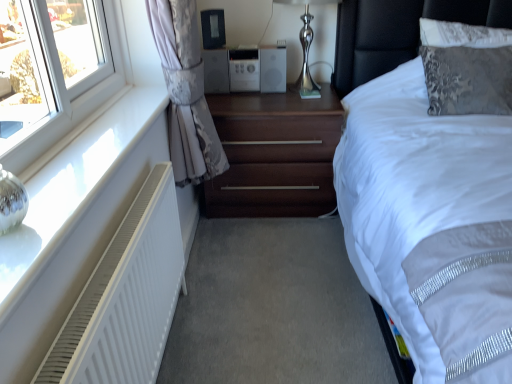
What do you see at coordinates (245, 70) in the screenshot?
I see `silver metallic stereo at center` at bounding box center [245, 70].

At what (x,y) coordinates should I click in order to perform the action: click on silver metallic stereo at center. Please return your answer as a coordinate pair (x, y). Looking at the image, I should click on (245, 70).

Describe the element at coordinates (275, 154) in the screenshot. I see `dark wood nightstand at center` at that location.

Find the location of `silky gray curtain at left`. silky gray curtain at left is located at coordinates (186, 92).

Where is `black plastic speaker at upper center`? The height and width of the screenshot is (384, 512). black plastic speaker at upper center is located at coordinates (213, 28).

Where is `white satin bed at right`? The width and height of the screenshot is (512, 384). white satin bed at right is located at coordinates (398, 32).

Would you consider white satin bed at right to be distant from silver metallic stereo at center?

No.

Could you tell me if white satin bed at right is turned towards silver metallic stereo at center?

No, white satin bed at right is not turned towards silver metallic stereo at center.

Is white satin bed at right outside of silver metallic stereo at center?

white satin bed at right lies outside silver metallic stereo at center's area.

Based on their positions, is white satin bed at right located to the left or right of silver metallic stereo at center?

Clearly, white satin bed at right is on the right of silver metallic stereo at center in the image.

Based on their positions, is dark wood nightstand at center located to the left or right of white matte radiator at left?

Clearly, dark wood nightstand at center is on the right of white matte radiator at left in the image.

Can you confirm if dark wood nightstand at center is wider than white matte radiator at left?

Indeed, dark wood nightstand at center has a greater width compared to white matte radiator at left.

Is dark wood nightstand at center facing away from white matte radiator at left?

No, dark wood nightstand at center's orientation is not away from white matte radiator at left.

From the image's perspective, which is above, dark wood nightstand at center or white matte radiator at left?

dark wood nightstand at center.

From a real-world perspective, which object stands above the other?

From a 3D spatial view, black leather headboard at upper right is above.

Is white satin bed at right a part of black leather headboard at upper right?

No.

From the image's perspective, is black leather headboard at upper right located beneath white satin bed at right?

No.

Is black leather headboard at upper right closer to the viewer compared to white satin bed at right?

No, the depth of black leather headboard at upper right is greater than that of white satin bed at right.

Is silky gray curtain at left wider than white matte radiator at lower left?

Incorrect, the width of silky gray curtain at left does not surpass that of white matte radiator at lower left.

Is silky gray curtain at left with white matte radiator at lower left?

No, silky gray curtain at left is not beside white matte radiator at lower left.

Is silky gray curtain at left outside of white matte radiator at lower left?

That's correct, silky gray curtain at left is outside of white matte radiator at lower left.

Does white matte radiator at left have a larger size compared to silver metallic stereo at center?

Yes.

Consider the image. From the image's perspective, who appears lower, white matte radiator at left or silver metallic stereo at center?

white matte radiator at left.

Is white matte radiator at left taller or shorter than silver metallic stereo at center?

In the image, white matte radiator at left appears to be taller than silver metallic stereo at center.

Is silky gray curtain at left oriented towards white satin bed at right?

Yes, silky gray curtain at left is aimed at white satin bed at right.

Considering the sizes of objects silky gray curtain at left and white satin bed at right in the image provided, who is smaller, silky gray curtain at left or white satin bed at right?

Smaller between the two is silky gray curtain at left.

This screenshot has width=512, height=384. Identify the location of bed below the silky gray curtain at left (from a real-world perspective). (398, 32).

Is black leather headboard at upper right facing towards white matte radiator at lower left?

No, black leather headboard at upper right is not aimed at white matte radiator at lower left.

What's the angular difference between black leather headboard at upper right and white matte radiator at lower left's facing directions?

The facing directions of black leather headboard at upper right and white matte radiator at lower left are 90.9 degrees apart.

Would you consider black leather headboard at upper right to be distant from white matte radiator at lower left?

black leather headboard at upper right is positioned a significant distance from white matte radiator at lower left.

From the picture: Visually, is black leather headboard at upper right positioned to the left or to the right of white matte radiator at lower left?

In the image, black leather headboard at upper right appears on the right side of white matte radiator at lower left.

Image resolution: width=512 pixels, height=384 pixels. What are the coordinates of `stereo behind the white satin bed at right` in the screenshot? It's located at (245, 70).

In the image, there is a white matte radiator at left. At what (x,y) coordinates should I click in order to perform the action: click on nightstand above it (from the image's perspective). Please return your answer as a coordinate pair (x, y). Image resolution: width=512 pixels, height=384 pixels. Looking at the image, I should click on (275, 154).

Based on their spatial positions, is white matte radiator at left or black plastic speaker at upper center closer to silver metallic stereo at center?

black plastic speaker at upper center is closer to silver metallic stereo at center.

Based on the photo, based on their spatial positions, is silky gray curtain at left or shiny metallic table lamp at upper center further from black plastic speaker at upper center?

silky gray curtain at left is positioned further to the anchor black plastic speaker at upper center.

Based on their spatial positions, is silver metallic stereo at center or shiny metallic table lamp at upper center closer to white matte radiator at lower left?

silver metallic stereo at center lies closer to white matte radiator at lower left than the other object.

Based on their spatial positions, is silver metallic stereo at center or black plastic speaker at upper center further from white matte radiator at lower left?

The object further to white matte radiator at lower left is black plastic speaker at upper center.

Consider the image. From the image, which object appears to be farther from white satin bed at right, silky gray curtain at left or dark wood nightstand at center?

The object further to white satin bed at right is silky gray curtain at left.

When comparing their distances from white satin bed at right, does black plastic speaker at upper center or silver metallic stereo at center seem further?

Among the two, black plastic speaker at upper center is located further to white satin bed at right.

Based on the photo, estimate the real-world distances between objects in this image. Which object is closer to white matte radiator at left, shiny metallic table lamp at upper center or black leather headboard at upper right?

shiny metallic table lamp at upper center lies closer to white matte radiator at left than the other object.

Looking at the image, which one is located closer to white satin bed at right, dark wood nightstand at center or silky gray curtain at left?

The object closer to white satin bed at right is dark wood nightstand at center.

Where is `nightstand between white matte radiator at lower left and silver metallic stereo at center along the z-axis`? Image resolution: width=512 pixels, height=384 pixels. nightstand between white matte radiator at lower left and silver metallic stereo at center along the z-axis is located at coordinates (275, 154).

I want to click on window sill between silky gray curtain at left and white matte radiator at left in the up-down direction, so click(72, 188).

You are a GUI agent. You are given a task and a screenshot of the screen. Output one action in this format:
    pyautogui.click(x=<x>, y=<y>)
    Task: Click on the curtain between white matte radiator at left and black plastic speaker at upper center in the front-back direction
    This screenshot has width=512, height=384.
    Given the screenshot: What is the action you would take?
    pyautogui.click(x=186, y=92)

You are a GUI agent. You are given a task and a screenshot of the screen. Output one action in this format:
    pyautogui.click(x=<x>, y=<y>)
    Task: Click on the headboard between white satin bed at right and dark wood nightstand at center along the z-axis
    This screenshot has height=384, width=512.
    Given the screenshot: What is the action you would take?
    pyautogui.click(x=397, y=32)